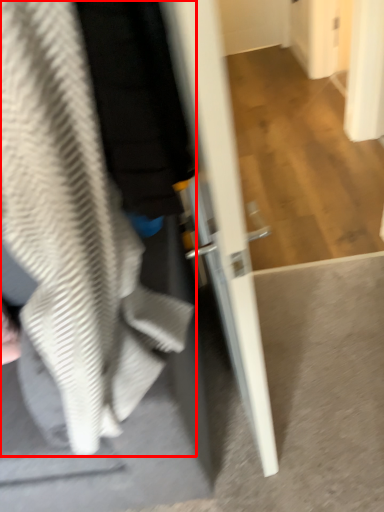
Question: From the image's perspective, where is sweatshirt (annotated by the red box) located relative to door?

Choices:
 (A) below
 (B) above

Answer: (A)